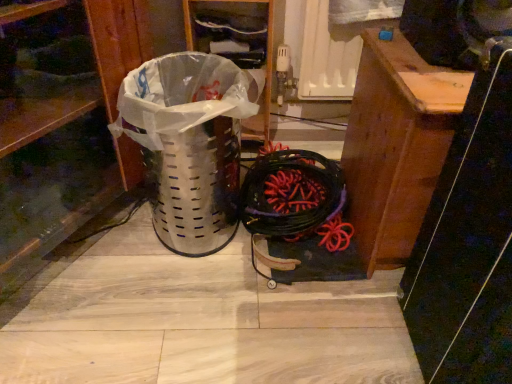
Question: From the image's perspective, would you say metallic perforated trash can at left is positioned over wooden plank at center?

Choices:
 (A) yes
 (B) no

Answer: (B)

Question: Could you tell me if metallic perforated trash can at left is facing wooden plank at center?

Choices:
 (A) yes
 (B) no

Answer: (B)

Question: Considering the relative sizes of metallic perforated trash can at left and wooden plank at center in the image provided, is metallic perforated trash can at left shorter than wooden plank at center?

Choices:
 (A) yes
 (B) no

Answer: (A)

Question: Is metallic perforated trash can at left in front of wooden plank at center?

Choices:
 (A) yes
 (B) no

Answer: (B)

Question: Is metallic perforated trash can at left looking in the opposite direction of wooden plank at center?

Choices:
 (A) no
 (B) yes

Answer: (A)

Question: Considering the relative positions of metallic perforated trash can at left and brushed metal trash can at left in the image provided, is metallic perforated trash can at left to the left or to the right of brushed metal trash can at left?

Choices:
 (A) right
 (B) left

Answer: (A)

Question: Is metallic perforated trash can at left taller or shorter than brushed metal trash can at left?

Choices:
 (A) short
 (B) tall

Answer: (A)

Question: Is metallic perforated trash can at left inside the boundaries of brushed metal trash can at left, or outside?

Choices:
 (A) inside
 (B) outside

Answer: (B)

Question: From the image's perspective, relative to brushed metal trash can at left, is metallic perforated trash can at left above or below?

Choices:
 (A) above
 (B) below

Answer: (B)

Question: Based on their positions, is metallic perforated trash can at left located to the left or right of black rubber battle rope at center?

Choices:
 (A) left
 (B) right

Answer: (A)

Question: Is metallic perforated trash can at left bigger or smaller than black rubber battle rope at center?

Choices:
 (A) big
 (B) small

Answer: (A)

Question: Does point (163, 193) appear closer or farther from the camera than point (242, 198)?

Choices:
 (A) farther
 (B) closer

Answer: (B)

Question: Is metallic perforated trash can at left situated inside black rubber battle rope at center or outside?

Choices:
 (A) inside
 (B) outside

Answer: (B)

Question: Would you say black rubber battle rope at center is to the left or to the right of wooden plank at center in the picture?

Choices:
 (A) right
 (B) left

Answer: (B)

Question: Is black rubber battle rope at center bigger or smaller than wooden plank at center?

Choices:
 (A) small
 (B) big

Answer: (A)